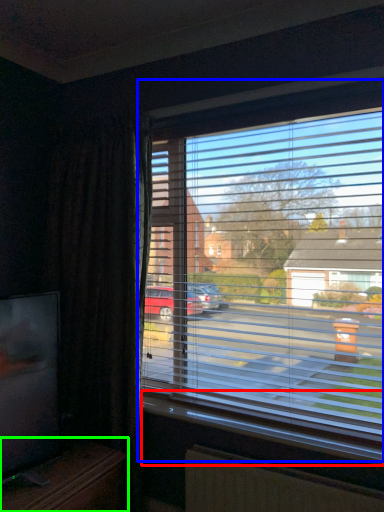
Question: Which is farther away from window sill (highlighted by a red box)? window (highlighted by a blue box) or entertainment center (highlighted by a green box)?

Choices:
 (A) window
 (B) entertainment center

Answer: (B)